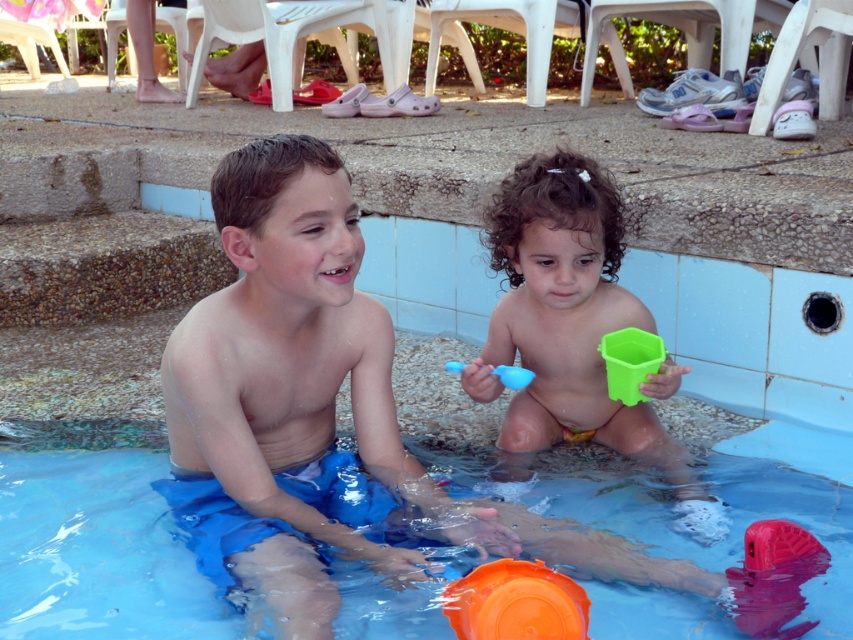
You are a parent watching your children play in the pool. You need to retrieve an item that the boy might accidentally step on. Which item is more likely to be underfoot, the orange plastic lid at lower center or the blue rubber toy at center?

The orange plastic lid at lower center is located below the blue rubber toy at center, so it is more likely to be underfoot as it is positioned lower in the pool.